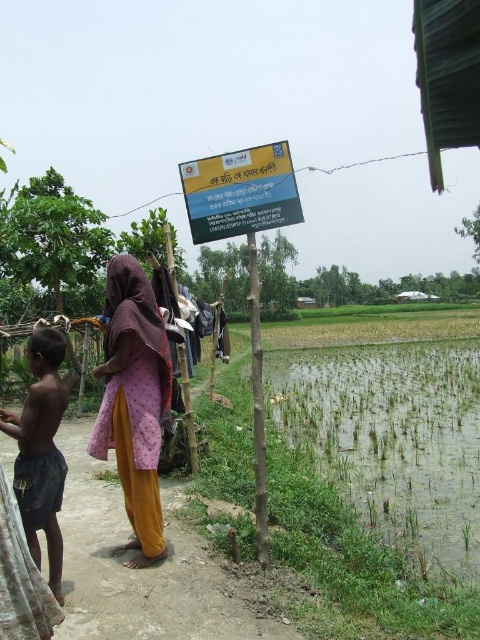
Question: Is green grassy flood at lower right below purple printed dress at left?

Choices:
 (A) yes
 (B) no

Answer: (A)

Question: Which object is positioned farthest from the purple printed dress at left?

Choices:
 (A) dark gray shorts at lower left
 (B) green grassy flood at lower right
 (C) pink fabric at center

Answer: (B)

Question: Does purple printed dress at left appear over pink fabric at center?

Choices:
 (A) no
 (B) yes

Answer: (A)

Question: Considering the real-world distances, which object is closest to the pink fabric at center?

Choices:
 (A) dark gray shorts at lower left
 (B) green grassy flood at lower right

Answer: (A)

Question: Can you confirm if green grassy flood at lower right is thinner than purple printed dress at left?

Choices:
 (A) no
 (B) yes

Answer: (A)

Question: Which point is farther from the camera taking this photo?

Choices:
 (A) (123, 387)
 (B) (51, 378)

Answer: (A)